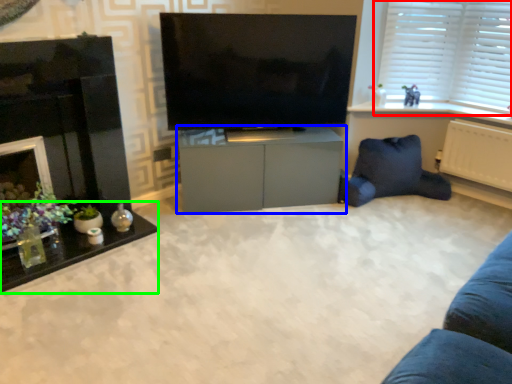
Question: Based on their relative distances, which object is nearer to window (highlighted by a red box)? Choose from cabinetry (highlighted by a blue box) and table (highlighted by a green box).

Choices:
 (A) cabinetry
 (B) table

Answer: (A)